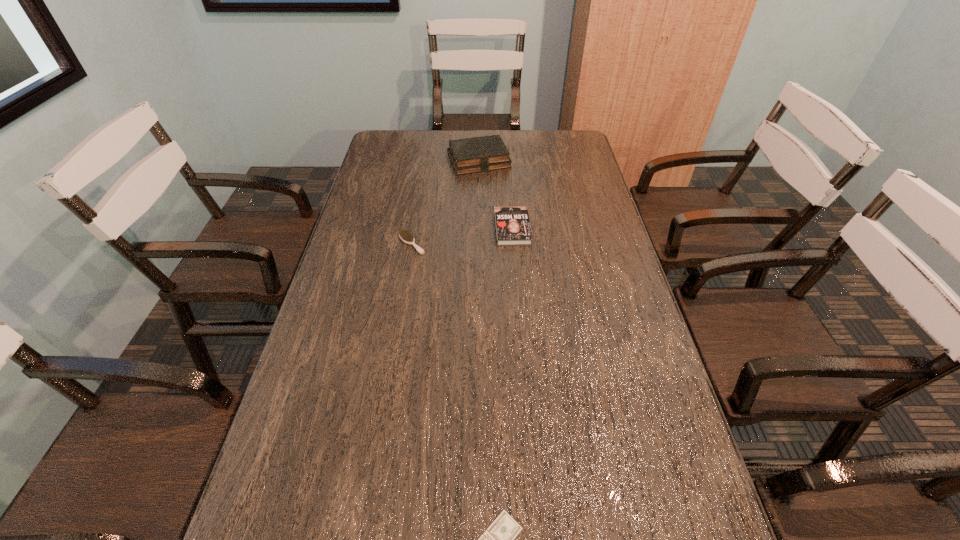
In the image, there is a desktop. Where is `free space at the right edge`? The height and width of the screenshot is (540, 960). free space at the right edge is located at coordinates pos(597,190).

The image size is (960, 540). I want to click on vacant space at the far left corner of the desktop, so click(x=402, y=159).

This screenshot has height=540, width=960. I want to click on vacant point located between the tallest object and the scrubbing brush, so click(445, 202).

Find the location of a particular element. The height and width of the screenshot is (540, 960). free space between the leftmost object and the shorter book is located at coordinates (462, 236).

Where is `free spot between the shorter book and the tallest object`? free spot between the shorter book and the tallest object is located at coordinates (495, 194).

Locate an element on the screen. This screenshot has height=540, width=960. vacant region between the scrubbing brush and the nearer book is located at coordinates (462, 236).

This screenshot has height=540, width=960. What are the coordinates of `free area in between the nearer book and the leftmost object` in the screenshot? It's located at (462, 236).

Identify which object is located as the nearest to the nearer book. Please provide its 2D coordinates. Your answer should be formatted as a tuple, i.e. [(x, y)], where the tuple contains the x and y coordinates of a point satisfying the conditions above.

[(406, 236)]

The height and width of the screenshot is (540, 960). I want to click on the third closest object to the shortest object, so click(477, 154).

Locate an element on the screen. This screenshot has width=960, height=540. free point that satisfies the following two spatial constraints: 1. on the front side of the farthest object; 2. on the left side of the nearer book is located at coordinates (479, 228).